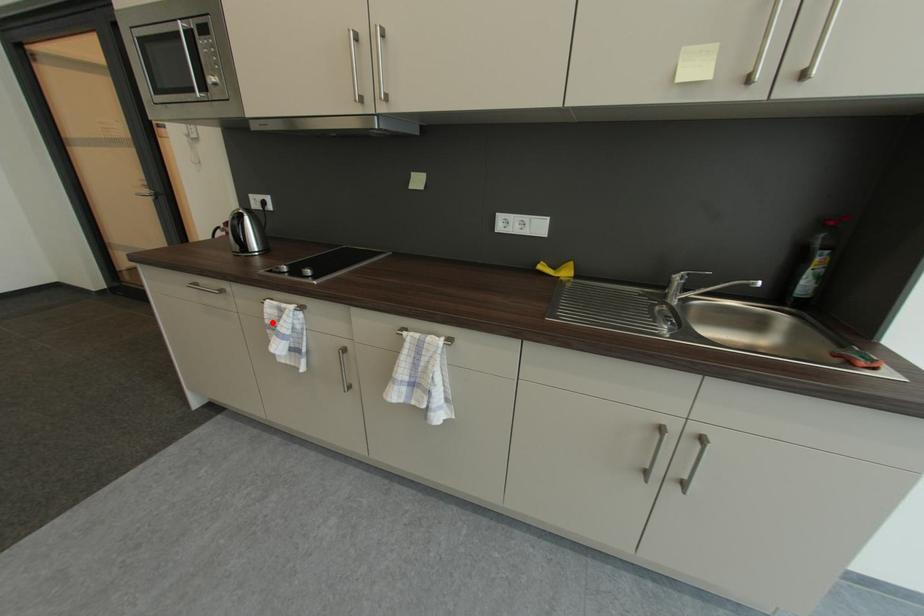
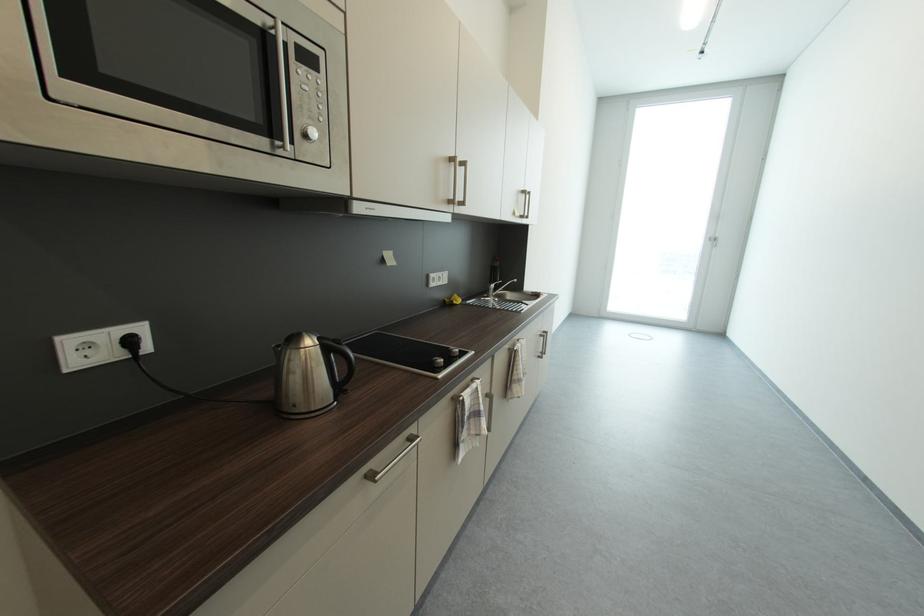
Locate, in the second image, the point that corresponds to the highlighted location in the first image.

(472, 419)